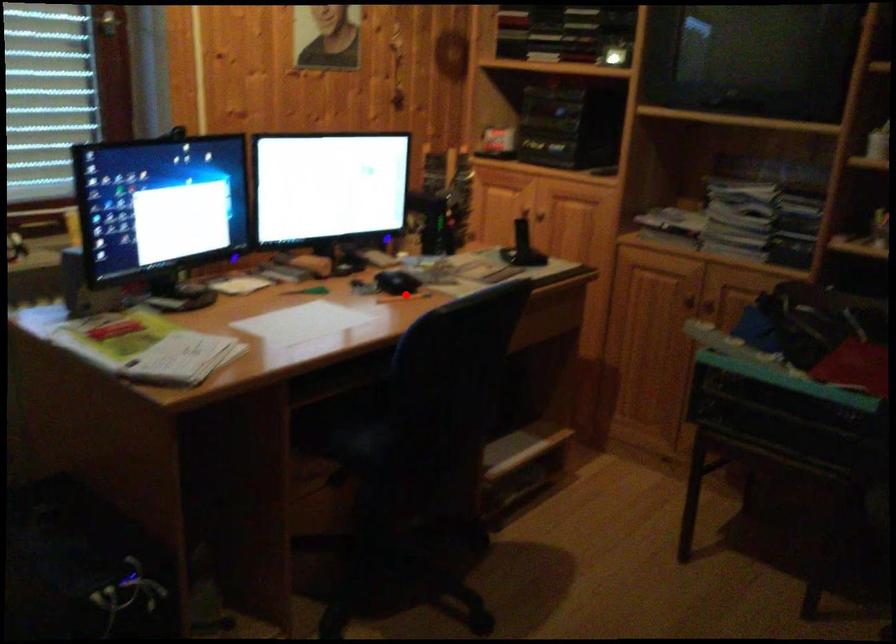
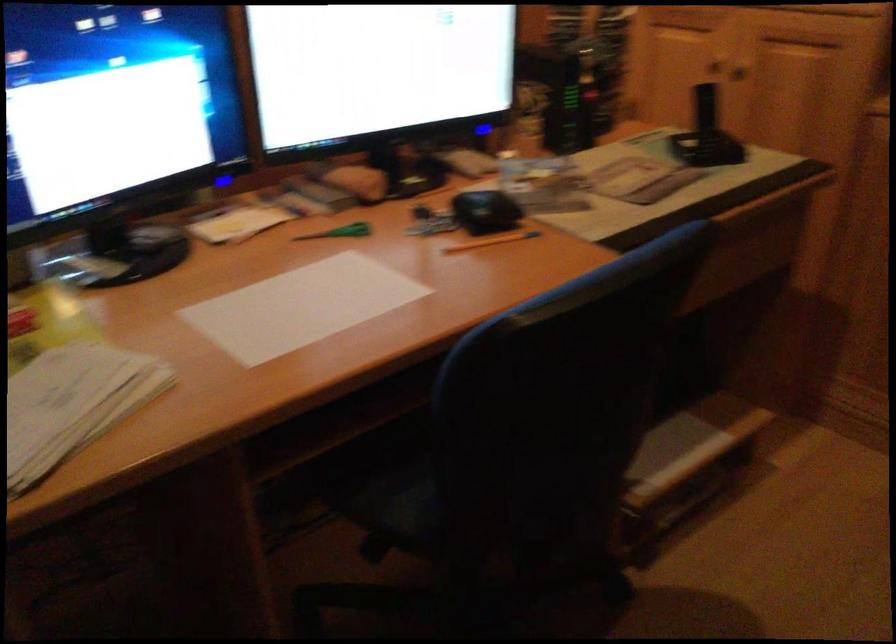
The point at the highlighted location is marked in the first image. Where is the corresponding point in the second image?

(493, 240)